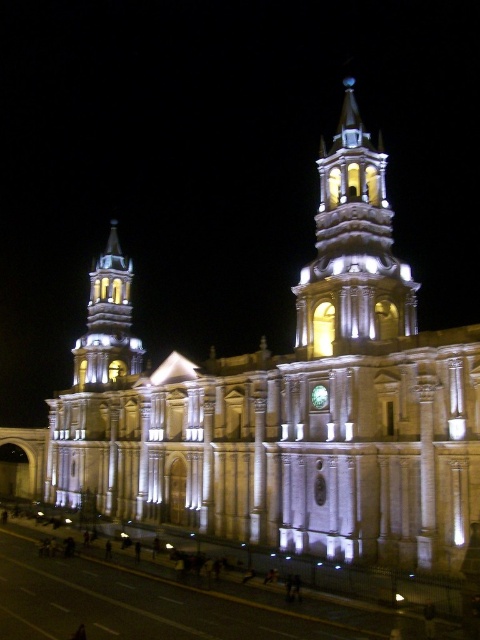
Which is in front, point (336, 337) or point (141, 353)?

Positioned in front is point (336, 337).

From the picture: Between white stone tower at upper center and white stone tower at left, which one has less height?

white stone tower at left is shorter.

The width and height of the screenshot is (480, 640). Find the location of `white stone tower at upper center`. white stone tower at upper center is located at coordinates (352, 248).